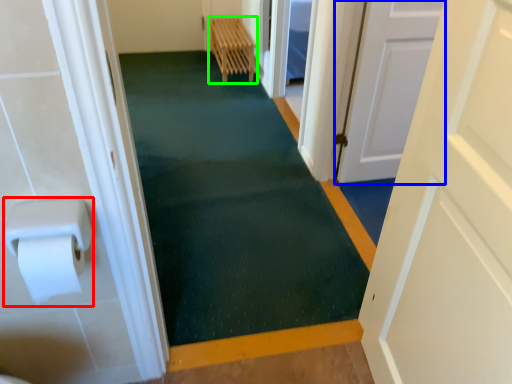
Question: Which object is the closest to the paper towel (highlighted by a red box)? Choose among these: door (highlighted by a blue box) or furniture (highlighted by a green box).

Choices:
 (A) door
 (B) furniture

Answer: (A)